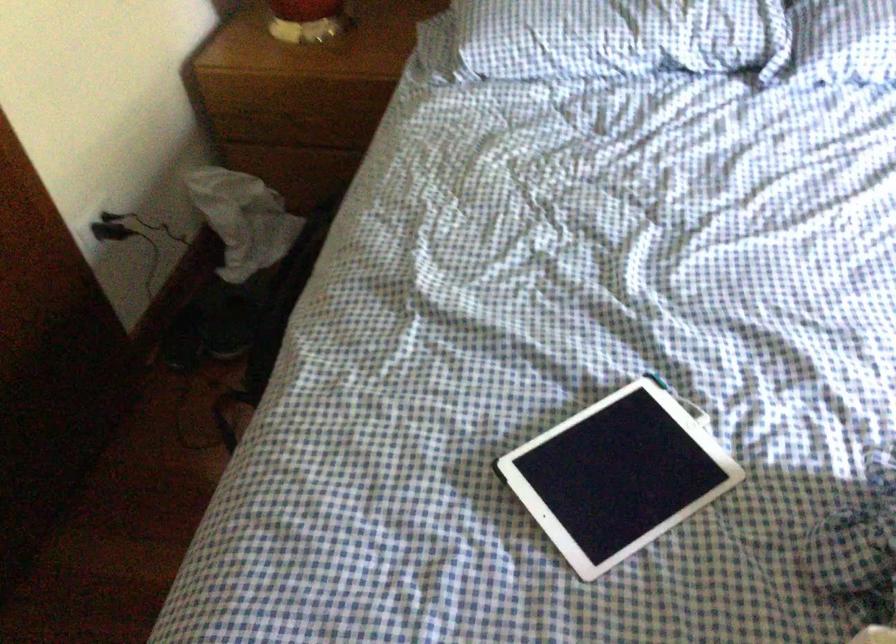
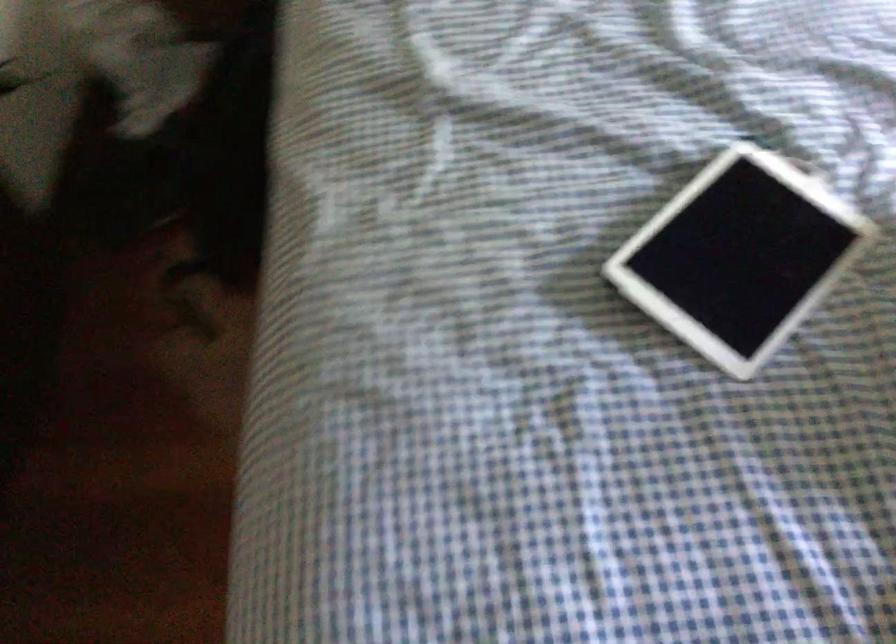
Question: The images are taken continuously from a first-person perspective. In which direction is your viewpoint rotating?

Choices:
 (A) Left
 (B) Right
 (C) Up
 (D) Down

Answer: (D)